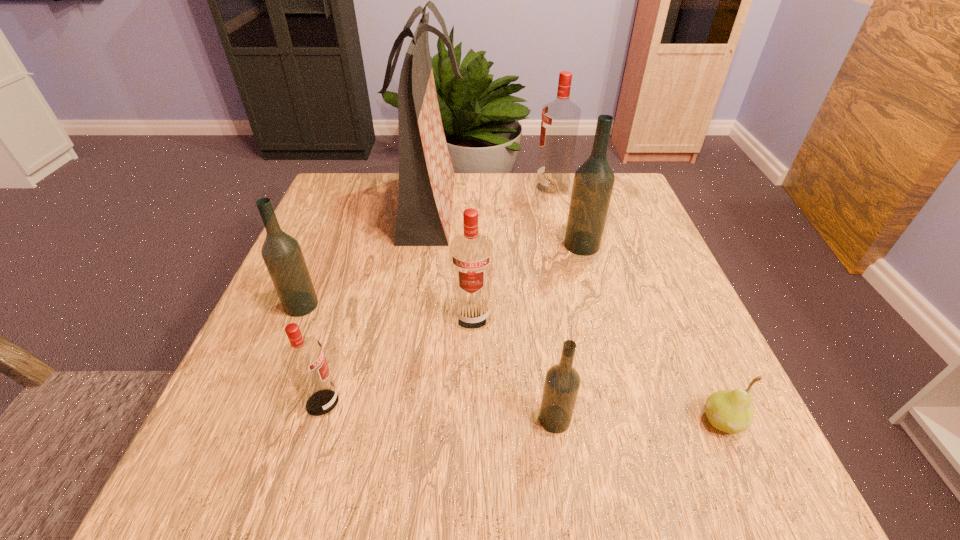
Where is `the tallest object`? the tallest object is located at coordinates (426, 176).

Locate an element on the screen. The width and height of the screenshot is (960, 540). the farthest red vodka is located at coordinates (560, 119).

This screenshot has width=960, height=540. In order to click on the rightmost red vodka in this screenshot , I will do `click(560, 119)`.

Find the location of a particular element. The height and width of the screenshot is (540, 960). the biggest black vodka is located at coordinates (593, 183).

Where is `the farthest black vodka`? the farthest black vodka is located at coordinates (593, 183).

Identify the location of the leftmost black vodka. The height and width of the screenshot is (540, 960). (282, 254).

You are a GUI agent. You are given a task and a screenshot of the screen. Output one action in this format:
    pyautogui.click(x=<x>, y=<y>)
    Task: Click on the second biggest black vodka
    The image size is (960, 540).
    Given the screenshot: What is the action you would take?
    pyautogui.click(x=282, y=254)

Find the location of a particular element. This screenshot has height=540, width=960. the second smallest red vodka is located at coordinates (471, 254).

What are the coordinates of `the second red vodka from right to left` in the screenshot? It's located at (471, 254).

At what (x,y) coordinates should I click in order to perform the action: click on the seventh object from right to left. Please return your answer as a coordinate pair (x, y). This screenshot has height=540, width=960. Looking at the image, I should click on (303, 358).